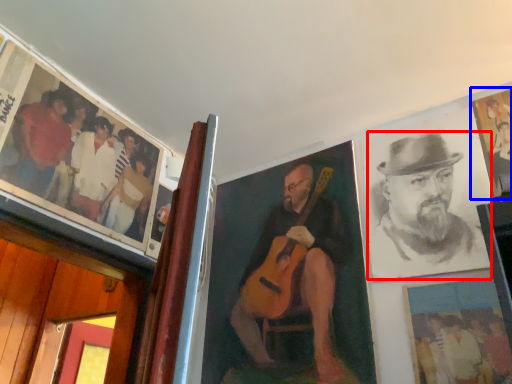
Question: Among these objects, which one is farthest to the camera, man (highlighted by a red box) or picture frame (highlighted by a blue box)?

Choices:
 (A) man
 (B) picture frame

Answer: (B)